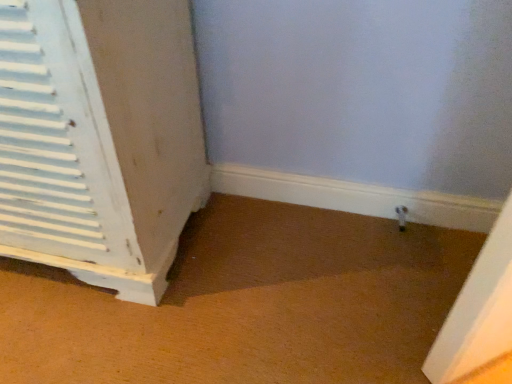
The height and width of the screenshot is (384, 512). I want to click on white painted wood door at left, so click(100, 139).

What do you see at coordinates (100, 139) in the screenshot? I see `white painted wood door at left` at bounding box center [100, 139].

In order to face white painted wood door at left, should I rotate leftwards or rightwards?

To face it directly, rotate left by 28.645 degrees.

What is the approximate height of white painted wood door at left?

It is 27.03 inches.

At what (x,y) coordinates should I click in order to perform the action: click on white painted wood door at left. Please return your answer as a coordinate pair (x, y). Looking at the image, I should click on (100, 139).